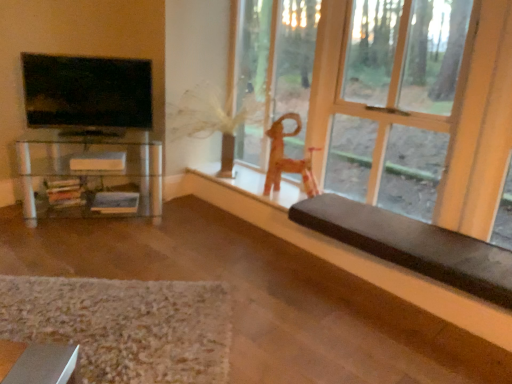
Locate an element on the screen. Image resolution: width=512 pixels, height=384 pixels. free space to the back side of textured beige rug at lower left is located at coordinates (153, 250).